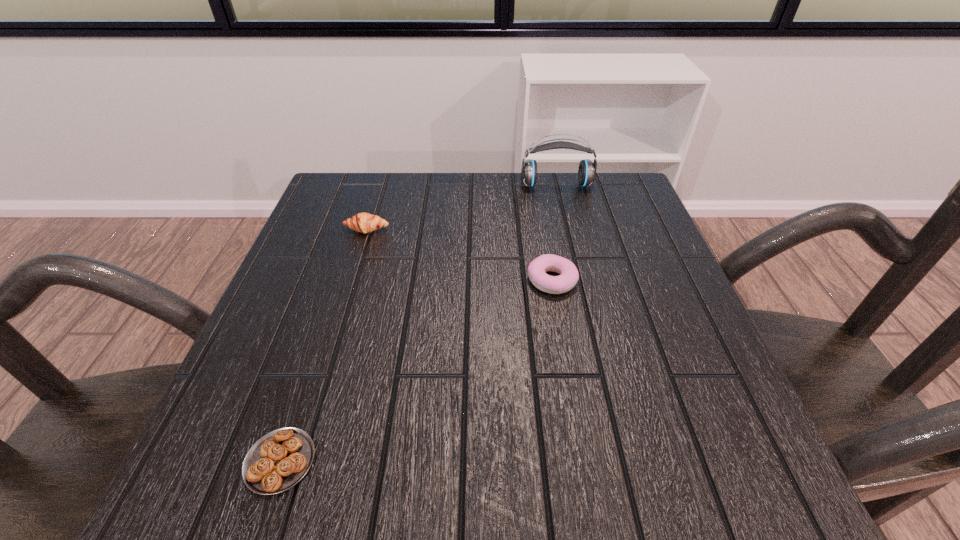
In the image, there is a desktop. Where is `free space at the left edge`? free space at the left edge is located at coordinates (273, 309).

Image resolution: width=960 pixels, height=540 pixels. I want to click on vacant point at the right edge, so click(x=654, y=312).

The image size is (960, 540). Find the location of `vacant space at the far right corner of the desktop`. vacant space at the far right corner of the desktop is located at coordinates (627, 187).

You are a GUI agent. You are given a task and a screenshot of the screen. Output one action in this format:
    pyautogui.click(x=<x>, y=<y>)
    Task: Click on the blank space at the near right corner
    
    Given the screenshot: What is the action you would take?
    pyautogui.click(x=766, y=463)

Identify the location of free area in between the nearest pastry and the farthest pastry. The height and width of the screenshot is (540, 960). (324, 345).

Locate an element on the screen. The height and width of the screenshot is (540, 960). empty space between the tallest object and the second nearest object is located at coordinates (554, 233).

Where is `vacant area that lies between the second farthest object and the nearest object`? The image size is (960, 540). vacant area that lies between the second farthest object and the nearest object is located at coordinates (324, 345).

The height and width of the screenshot is (540, 960). What are the coordinates of `free area in between the second farthest object and the nearest pastry` in the screenshot? It's located at (324, 345).

Locate an element on the screen. vacant point located between the farthest object and the second farthest pastry is located at coordinates (554, 233).

The height and width of the screenshot is (540, 960). Identify the location of blank region between the headset and the third farthest object. (554, 233).